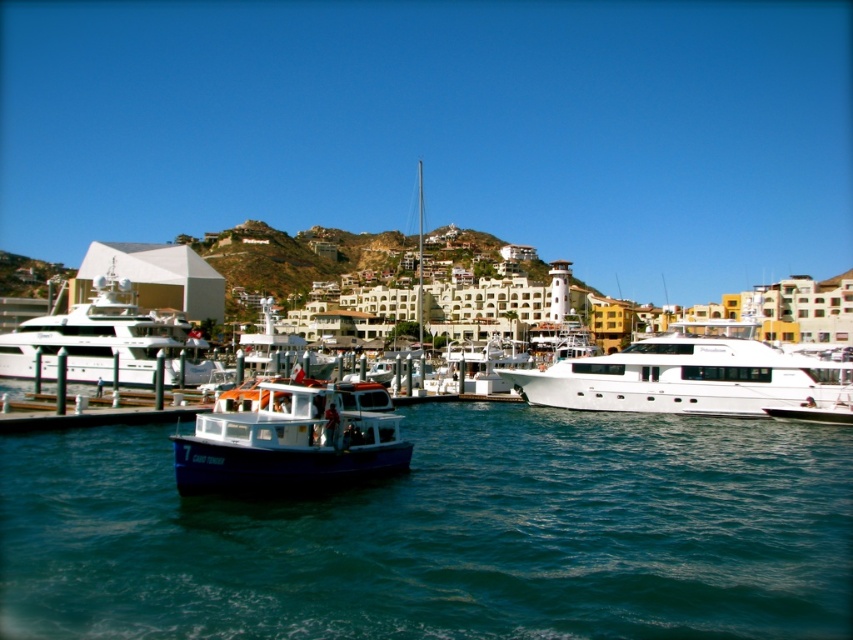
You are a dock worker who needs to ensure that both the white glossy yacht at right and the blue matte boat at center can fit into a new docking bay that is 10 meters wide. Given their widths, will they both fit side by side?

The white glossy yacht at right is wider than the blue matte boat at center. Since the docking bay is 10 meters wide, we need to know their exact widths to determine if they can fit together. However, the provided information only states that the yacht is wider, not by how much. Without specific measurements, it is impossible to confirm if both will fit side by side in the 10 meter wide docking bay.

You are a photographer trying to capture both the white glossy yacht at right and the blue matte boat at center in a single shot. Based on their positions, which vessel should you position closer to the left side of your camera frame?

The blue matte boat at center should be positioned closer to the left side of your camera frame because the white glossy yacht at right is on the right side of it.

You are standing at the edge of the marina and see the blue water at center and the white glossy yacht at left. Which object is nearer to you?

The blue water at center is closer to the viewer than the white glossy yacht at left.